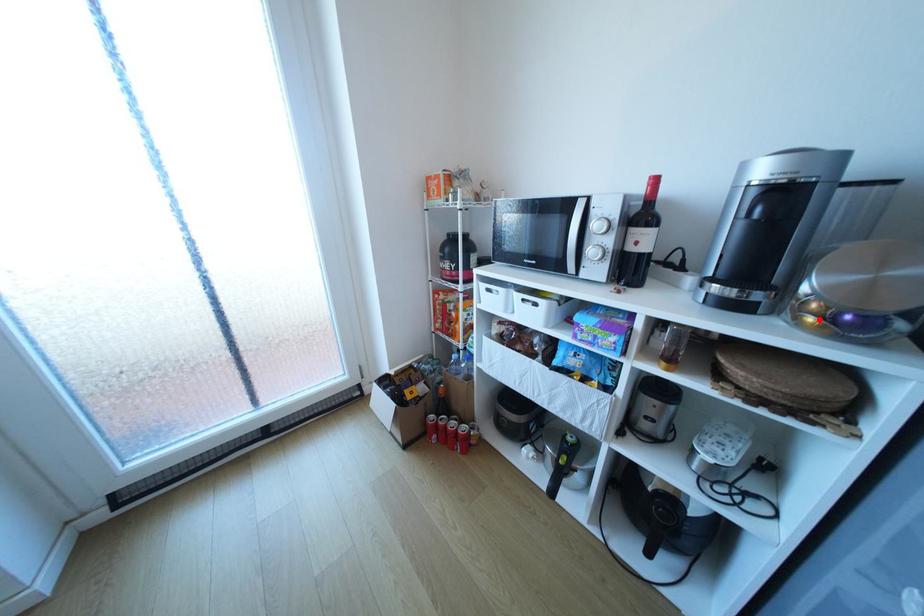
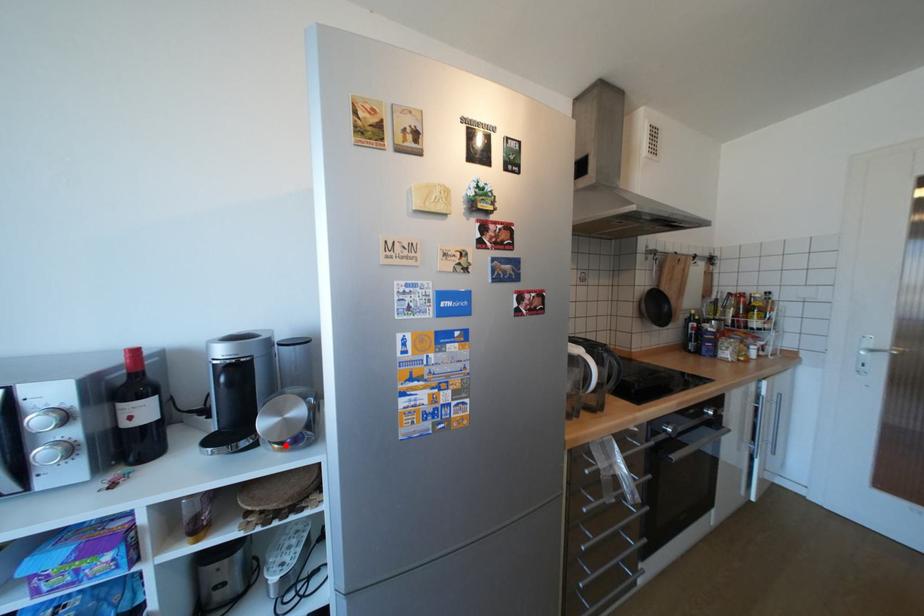
I am providing you with two images of the same scene from different viewpoints. A red point is marked on the first image and another point is marked on the second image. Are the points marked in image1 and image2 representing the same 3D position?

Yes